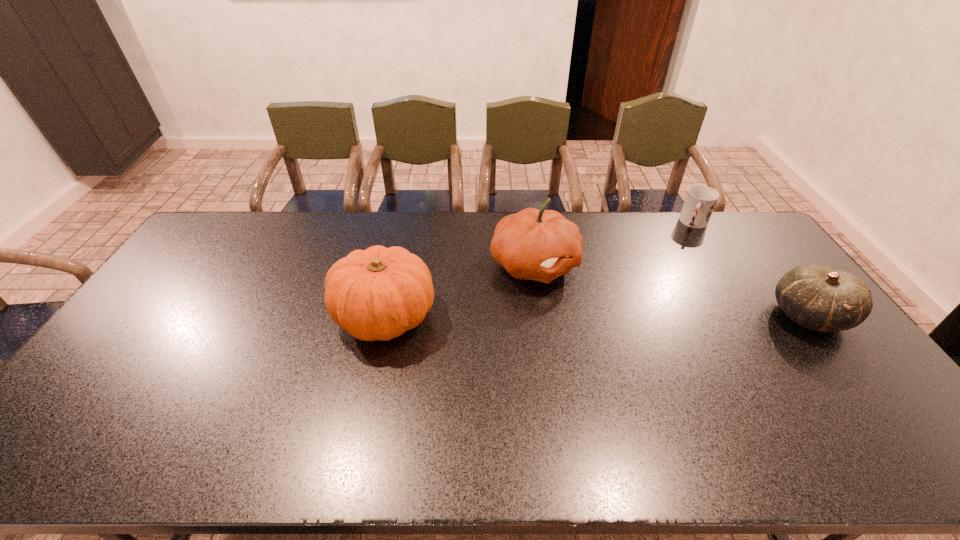
Where is `the left pumpkin`? This screenshot has width=960, height=540. the left pumpkin is located at coordinates (379, 293).

Locate an element on the screen. This screenshot has height=540, width=960. gourd is located at coordinates (819, 298).

In order to click on the third tallest object in this screenshot , I will do `click(819, 298)`.

Where is `the second object from left to right`? The height and width of the screenshot is (540, 960). the second object from left to right is located at coordinates (541, 245).

Locate an element on the screen. This screenshot has height=540, width=960. cup is located at coordinates (700, 201).

Identify the location of the second object from right to left. (700, 201).

Find the location of a particular element. Image resolution: width=960 pixels, height=540 pixels. free space located on the left of the leftmost object is located at coordinates (247, 315).

I want to click on free space located on the left of the second shortest object, so click(x=754, y=316).

Image resolution: width=960 pixels, height=540 pixels. In order to click on vacant position located 0.140m on the front face of the right pumpkin in this screenshot , I will do `click(617, 298)`.

The height and width of the screenshot is (540, 960). Find the location of `free region located on the front face of the right pumpkin`. free region located on the front face of the right pumpkin is located at coordinates (596, 289).